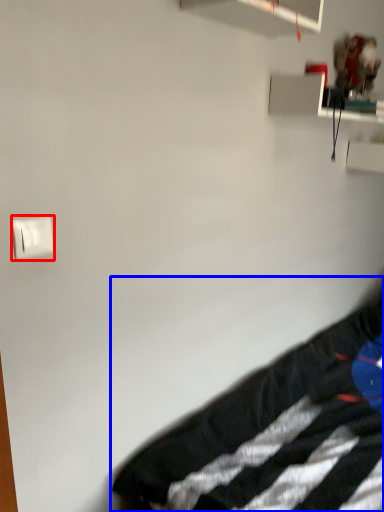
Question: Which object appears closest to the camera in this image, light switch (highlighted by a red box) or furniture (highlighted by a blue box)?

Choices:
 (A) light switch
 (B) furniture

Answer: (B)